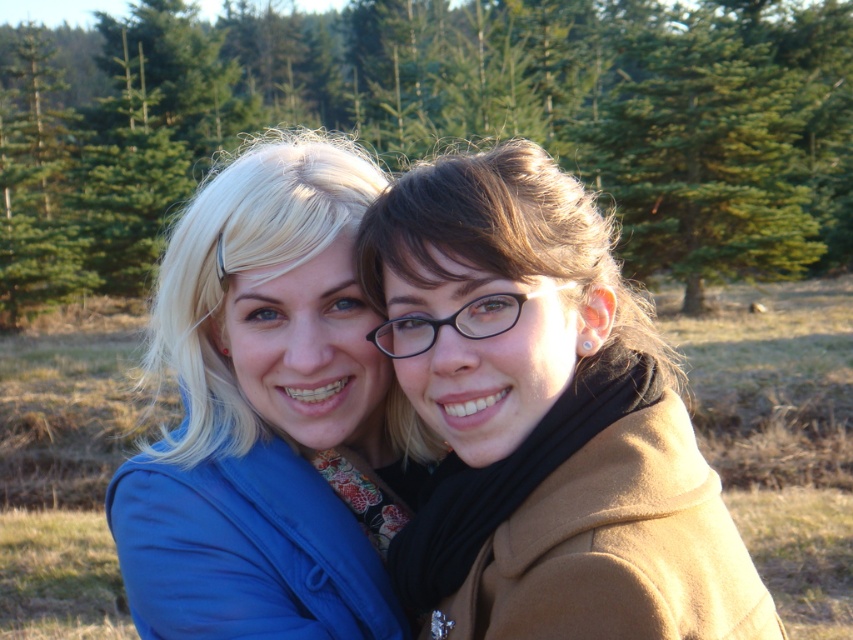
Can you confirm if green matte tree at center is smaller than brown woolen coat at right?

Incorrect, green matte tree at center is not smaller in size than brown woolen coat at right.

Where is `green matte tree at center`? The height and width of the screenshot is (640, 853). green matte tree at center is located at coordinates (438, 122).

Who is more distant from viewer, (836, 74) or (566, 582)?

The point (836, 74) is more distant.

I want to click on green matte tree at center, so click(438, 122).

Does point (294, 49) come farther from viewer compared to point (204, 220)?

Yes, point (294, 49) is farther from viewer.

Is green matte tree at center to the left of blue fabric jacket at center from the viewer's perspective?

Yes, green matte tree at center is to the left of blue fabric jacket at center.

Which is in front, point (137, 195) or point (277, 538)?

Positioned in front is point (277, 538).

You are a GUI agent. You are given a task and a screenshot of the screen. Output one action in this format:
    pyautogui.click(x=<x>, y=<y>)
    Task: Click on the green matte tree at center
    
    Given the screenshot: What is the action you would take?
    pyautogui.click(x=438, y=122)

Can you confirm if brown woolen coat at right is positioned above blue fabric jacket at center?

No.

Can you confirm if brown woolen coat at right is positioned below blue fabric jacket at center?

Correct, brown woolen coat at right is located below blue fabric jacket at center.

Is point (451, 499) farther from viewer compared to point (250, 563)?

That is False.

At what (x,y) coordinates should I click in order to perform the action: click on brown woolen coat at right. Please return your answer as a coordinate pair (x, y). Looking at the image, I should click on (544, 419).